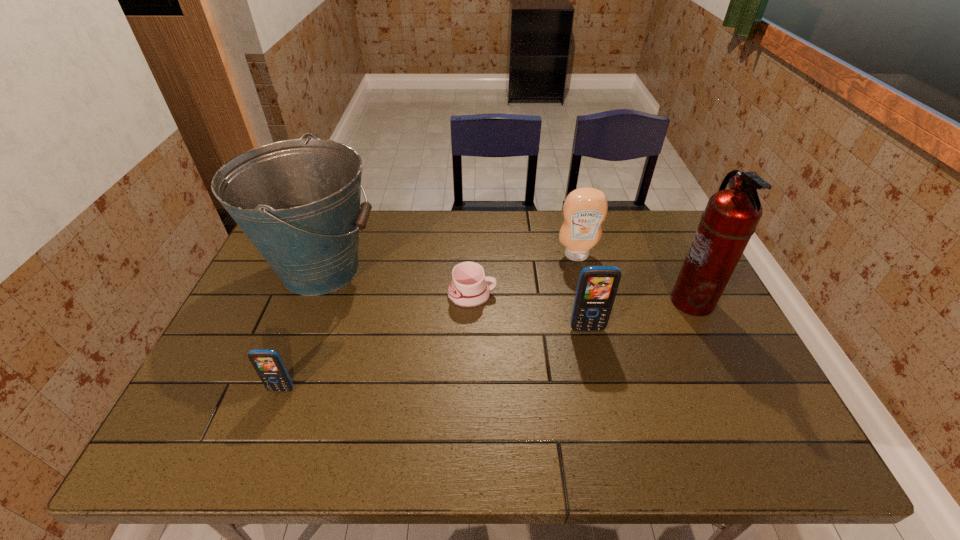
This screenshot has width=960, height=540. I want to click on free space located on the screen of the farther cellular telephone, so click(607, 413).

The image size is (960, 540). In order to click on vacant space situated with the handle on opposite sides of the bucket in this screenshot , I will do `click(471, 269)`.

Find the location of `free space located on the nozzle side of the rightmost object`. free space located on the nozzle side of the rightmost object is located at coordinates (534, 301).

Find the location of `free spot located on the nozzle side of the rightmost object`. free spot located on the nozzle side of the rightmost object is located at coordinates (642, 301).

This screenshot has width=960, height=540. I want to click on vacant region located on the nozzle side of the rightmost object, so click(617, 301).

Identify the location of blank area located 0.370m on the label of the condiment. (603, 360).

Where is `free space located on the side with the handle of the third object from left to right`? free space located on the side with the handle of the third object from left to right is located at coordinates (583, 295).

The image size is (960, 540). I want to click on bucket that is at the far edge, so [298, 201].

This screenshot has width=960, height=540. I want to click on condiment that is at the far edge, so click(584, 210).

Locate an element on the screen. object that is positioned at the near edge is located at coordinates (268, 364).